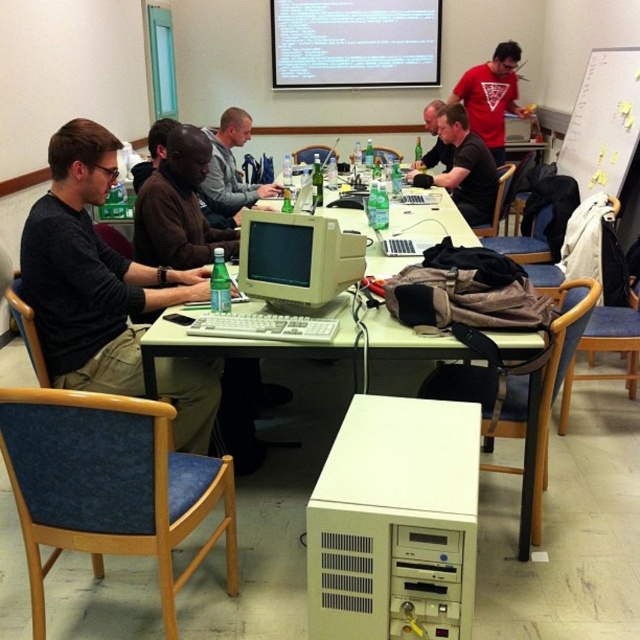
You are attending a retro computing workshop and notice two people sitting at the table. One is wearing a gray sweater at center, and the other is wearing a matte black shirt at center. From your perspective facing the table, which person is sitting to the right?

The matte black shirt at center is to the right of the gray sweater at center.

You are a technician who needs to connect a cable between the matte plastic monitor at center and the white plastic table at center. The cable you have is 12 inches long. Will it reach?

The matte plastic monitor at center and white plastic table at center are 11.67 inches apart from each other. The cable is 12 inches long, which is slightly longer than the distance between them. Therefore, the cable will reach.

You are standing in the conference room and want to reach the point at coordinates point [296,273]. The table is cluttered with items. Can you walk directly to that point without moving any objects?

The point [296,273] is 2.26 meters from the viewer, which is a considerable distance. However, the table is cluttered with items like bottles, laptops, and bags, which may block the path. To determine if you can walk directly, you would need to assess the arrangement of the clutter. Since the description mentions the table is cluttered but doesn